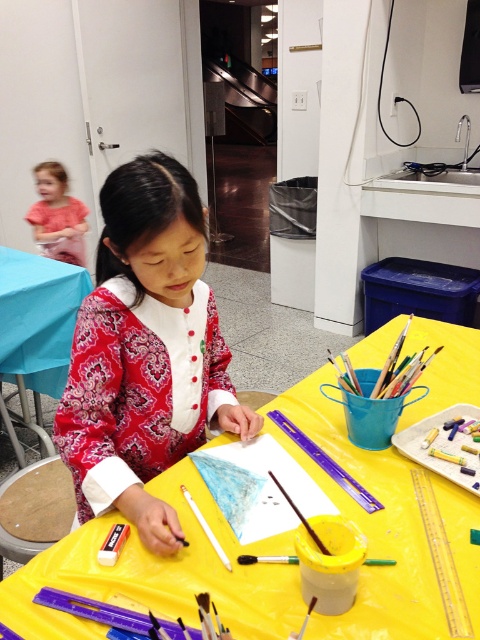
The width and height of the screenshot is (480, 640). I want to click on matte red dress at center, so click(144, 352).

Looking at this image, between matte red dress at center and matte blue table at center, which one appears on the left side from the viewer's perspective?

From the viewer's perspective, matte blue table at center appears more on the left side.

Who is more forward, (105, 417) or (24, 413)?

Point (105, 417) is in front.

Locate an element on the screen. The image size is (480, 640). matte red dress at center is located at coordinates (144, 352).

In the scene shown: Is yellow plastic table at center to the left of matte blue table at center from the viewer's perspective?

Incorrect, yellow plastic table at center is not on the left side of matte blue table at center.

Is point (211, 589) positioned after point (20, 337)?

No, (211, 589) is closer to viewer.

Where is `yellow plastic table at center`? yellow plastic table at center is located at coordinates (157, 576).

Is point (411, 508) more distant than point (48, 166)?

No, it is in front of (48, 166).

Does yellow plastic table at center appear on the right side of matte pink shirt at upper left?

Indeed, yellow plastic table at center is positioned on the right side of matte pink shirt at upper left.

You are a GUI agent. You are given a task and a screenshot of the screen. Output one action in this format:
    pyautogui.click(x=<x>, y=<y>)
    Task: Click on the yellow plastic table at center
    This screenshot has width=480, height=640.
    Given the screenshot: What is the action you would take?
    pyautogui.click(x=157, y=576)